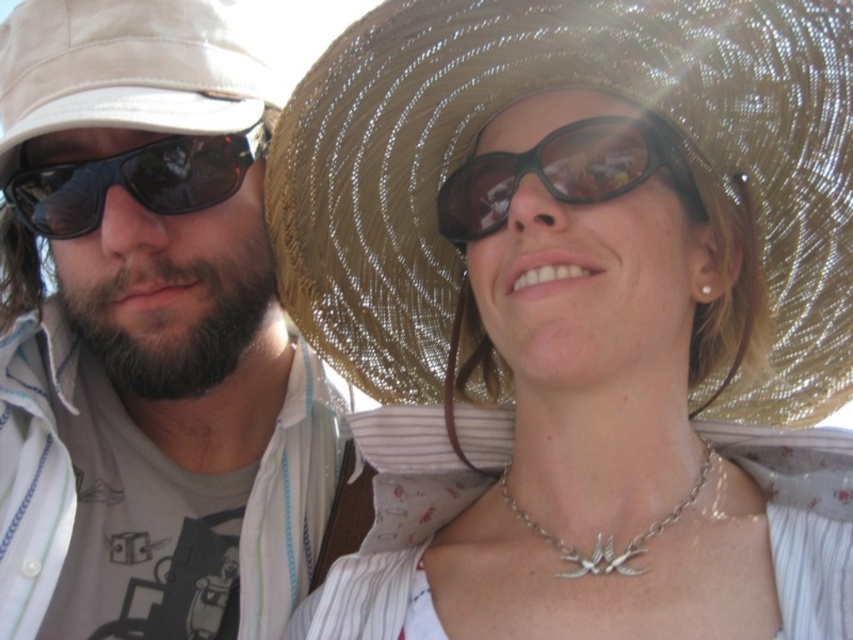
Who is lower down, beige fabric cowboy hat at left or silver metallic necklace at center?

Positioned lower is silver metallic necklace at center.

How distant is beige fabric cowboy hat at left from silver metallic necklace at center?

beige fabric cowboy hat at left and silver metallic necklace at center are 32.89 inches apart from each other.

The height and width of the screenshot is (640, 853). What are the coordinates of `beige fabric cowboy hat at left` in the screenshot? It's located at (129, 68).

Is woven straw hat at upper center to the right of black plastic sunglasses at center from the viewer's perspective?

Indeed, woven straw hat at upper center is positioned on the right side of black plastic sunglasses at center.

Which is behind, point (793, 214) or point (543, 154)?

The point (793, 214) is behind.

Is point (755, 216) positioned after point (498, 179)?

That is True.

You are a GUI agent. You are given a task and a screenshot of the screen. Output one action in this format:
    pyautogui.click(x=<x>, y=<y>)
    Task: Click on the woven straw hat at upper center
    Image resolution: width=853 pixels, height=640 pixels.
    Given the screenshot: What is the action you would take?
    pyautogui.click(x=555, y=88)

Is point (59, 449) less distant than point (506, 81)?

No, (59, 449) is behind (506, 81).

What do you see at coordinates (148, 336) in the screenshot? I see `matte white hat at left` at bounding box center [148, 336].

Is point (178, 202) closer to camera compared to point (842, 92)?

That is False.

Locate an element on the screen. The width and height of the screenshot is (853, 640). matte white hat at left is located at coordinates pyautogui.click(x=148, y=336).